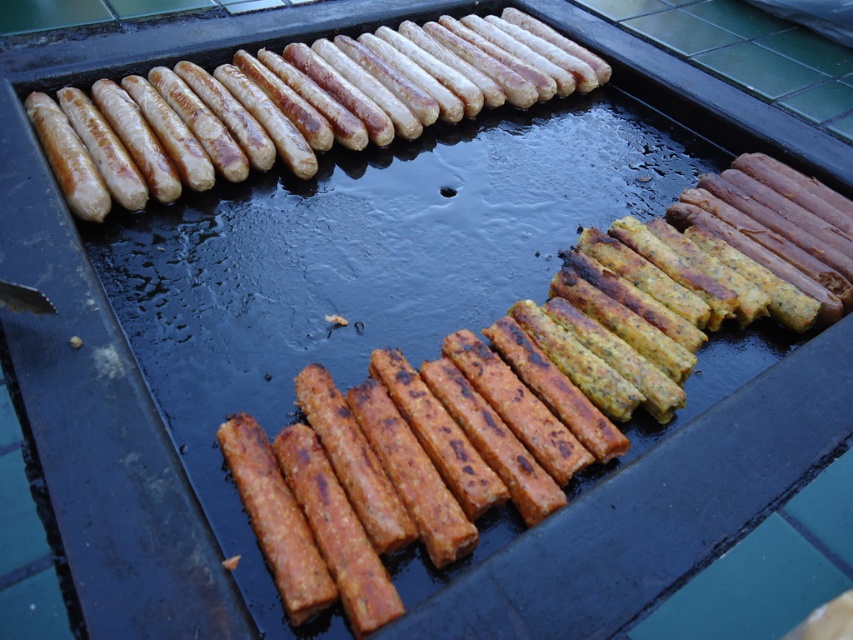
Can you confirm if golden-brown glazed sausages at upper left is positioned below brown crumbly sausage at center?

Actually, golden-brown glazed sausages at upper left is above brown crumbly sausage at center.

Is golden-brown glazed sausages at upper left bigger than brown crumbly sausage at center?

Correct, golden-brown glazed sausages at upper left is larger in size than brown crumbly sausage at center.

Which is behind, point (465, 52) or point (296, 531)?

The point (465, 52) is more distant.

Where is `golden-brown glazed sausages at upper left`? golden-brown glazed sausages at upper left is located at coordinates (300, 104).